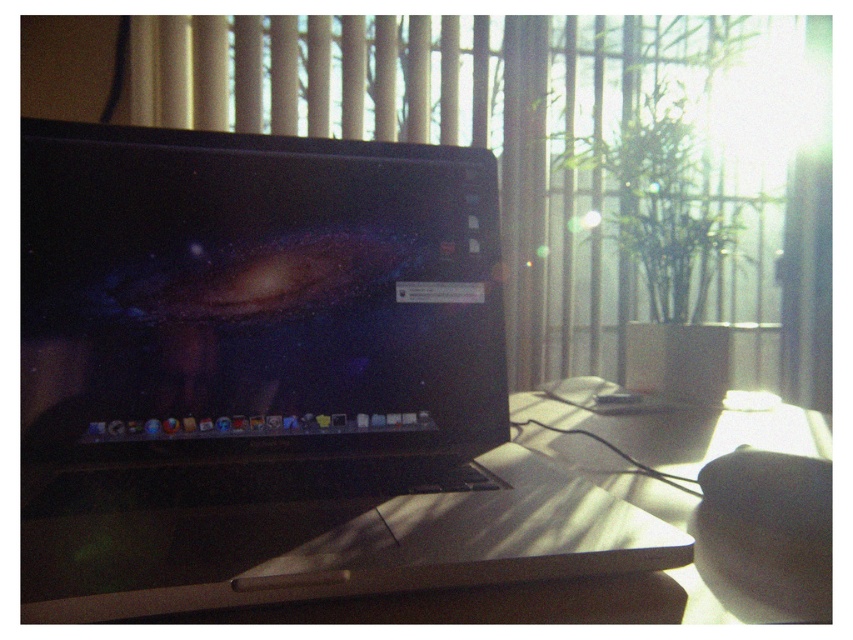
Consider the image. You are a delivery robot trying to navigate to the transparent glass window at center. The room has a coordinate system where the bottom left corner is the origin. Your current position is at point A with coordinates at point A is at point A is at point A is at point A is at point A is at point A is at point A is at point A is at point A is at point A is at point point A is at point A is at point A is at point A is at point A is at point A is at point A is at point A is at point A is at point A is at point

The transparent glass window at center is located at point A is at point A is at point A is at point A is at point A is at point A is at point A is at point A is at point A is at point A is at point point A is at point A is at point A is at point A is at point A is at point A is at point A is at point A is at point A is at point A is at point

You are setting up a new workspace and want to place a thin notebook between the satin black laptop at center and the smooth wooden table at center. Can the notebook fit between them based on their thickness?

The satin black laptop at center is thinner than the smooth wooden table at center, so the notebook can fit between them as there is enough space due to the laptop being thinner.

Consider the image. You are standing in front of the desk and want to place a small object on the desk. The desk has two points marked as point 1 at coordinates (251, 358) and point 2 at coordinates (567, 250). Which point is closer to you?

Point 1 at coordinates (251, 358) is closer to the viewer than point 2 at coordinates (567, 250).